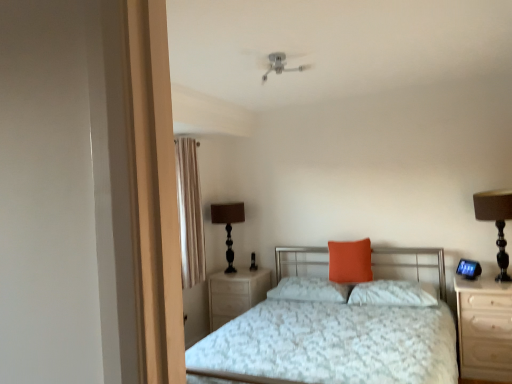
This screenshot has width=512, height=384. In order to click on free space above metallic silver mechanical fan at upper center (from a real-world perspective) in this screenshot , I will do `click(275, 49)`.